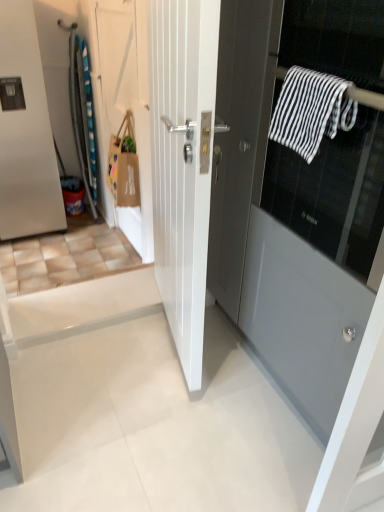
Question: Is matte gray door at center, which is the first door in right-to-left order, shorter than black and white striped towel at upper right?

Choices:
 (A) no
 (B) yes

Answer: (A)

Question: Is black and white striped towel at upper right located within matte gray door at center, the 4th door positioned from the left?

Choices:
 (A) yes
 (B) no

Answer: (A)

Question: From a real-world perspective, is matte gray door at center, which is the first door in right-to-left order, located beneath black and white striped towel at upper right?

Choices:
 (A) no
 (B) yes

Answer: (B)

Question: From a real-world perspective, is matte gray door at center, which is the first door in right-to-left order, on top of black and white striped towel at upper right?

Choices:
 (A) no
 (B) yes

Answer: (A)

Question: Would you consider matte gray door at center, which is the first door in right-to-left order, to be distant from black and white striped towel at upper right?

Choices:
 (A) no
 (B) yes

Answer: (A)

Question: Which is correct: matte gray door at center, the 4th door positioned from the left, is inside satin silver refrigerator at left, which is the 4th door from right to left, or outside of it?

Choices:
 (A) outside
 (B) inside

Answer: (A)

Question: From their relative heights in the image, would you say matte gray door at center, which is the first door in right-to-left order, is taller or shorter than satin silver refrigerator at left, which is the 4th door from right to left?

Choices:
 (A) tall
 (B) short

Answer: (B)

Question: In the image, is matte gray door at center, which is the first door in right-to-left order, positioned in front of or behind satin silver refrigerator at left, the first door when ordered from left to right?

Choices:
 (A) front
 (B) behind

Answer: (A)

Question: Does point (355, 162) appear closer or farther from the camera than point (59, 225)?

Choices:
 (A) farther
 (B) closer

Answer: (B)

Question: Is satin silver refrigerator at left, the first door when ordered from left to right, wider or thinner than white matte door at upper left, placed as the 2th door when sorted from left to right?

Choices:
 (A) thin
 (B) wide

Answer: (B)

Question: From their relative heights in the image, would you say satin silver refrigerator at left, which is the 4th door from right to left, is taller or shorter than white matte door at upper left, which appears as the 3th door when viewed from the right?

Choices:
 (A) tall
 (B) short

Answer: (B)

Question: Visually, is satin silver refrigerator at left, which is the 4th door from right to left, positioned to the left or to the right of white matte door at upper left, placed as the 2th door when sorted from left to right?

Choices:
 (A) left
 (B) right

Answer: (A)

Question: Is point (3, 160) closer or farther from the camera than point (150, 221)?

Choices:
 (A) farther
 (B) closer

Answer: (A)

Question: Considering the positions of white glossy door at center, placed as the second door when sorted from right to left, and satin silver refrigerator at left, which is the 4th door from right to left, in the image, is white glossy door at center, placed as the second door when sorted from right to left, bigger or smaller than satin silver refrigerator at left, which is the 4th door from right to left,?

Choices:
 (A) big
 (B) small

Answer: (B)

Question: Do you think white glossy door at center, placed as the second door when sorted from right to left, is within satin silver refrigerator at left, which is the 4th door from right to left, or outside of it?

Choices:
 (A) outside
 (B) inside

Answer: (A)